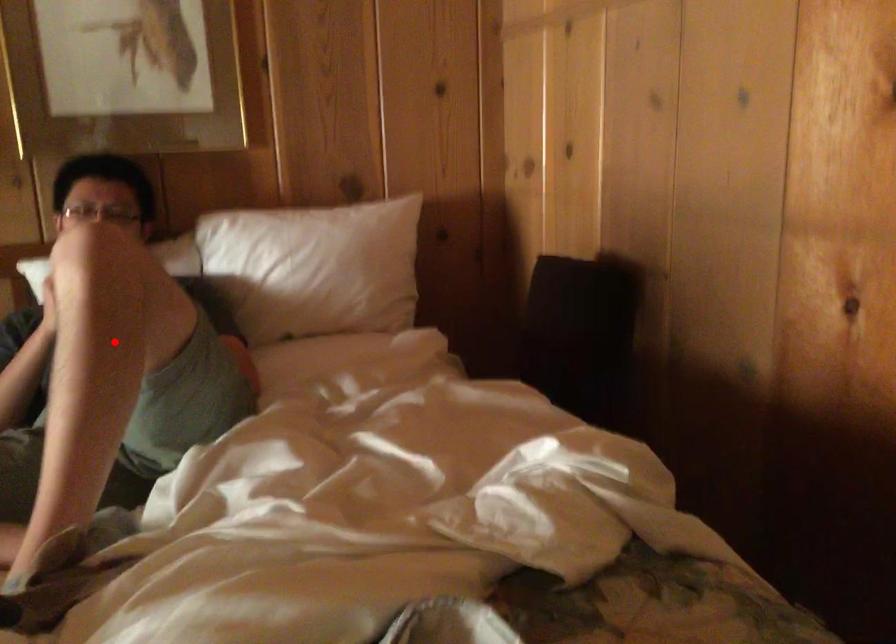
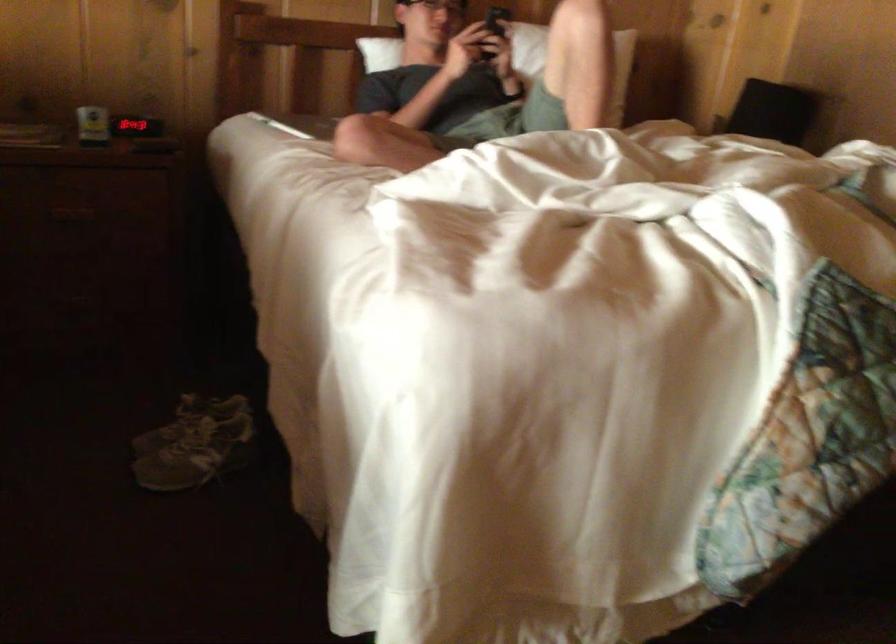
Question: A red point is marked in image1. In image2, is the corresponding 3D point closer to the camera or farther? Reply with the corresponding letter.

Choices:
 (A) The corresponding 3D point is closer.
 (B) The corresponding 3D point is farther.

Answer: (B)